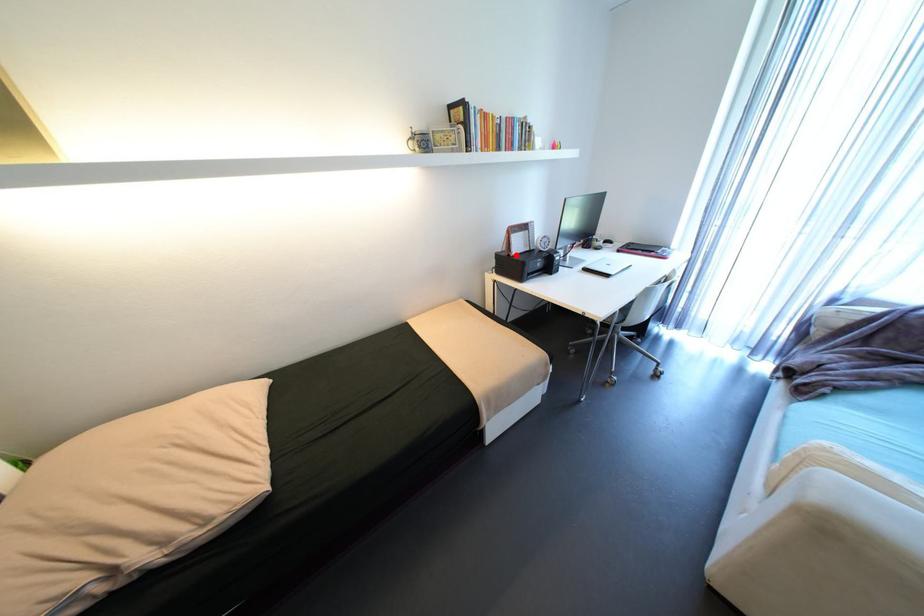
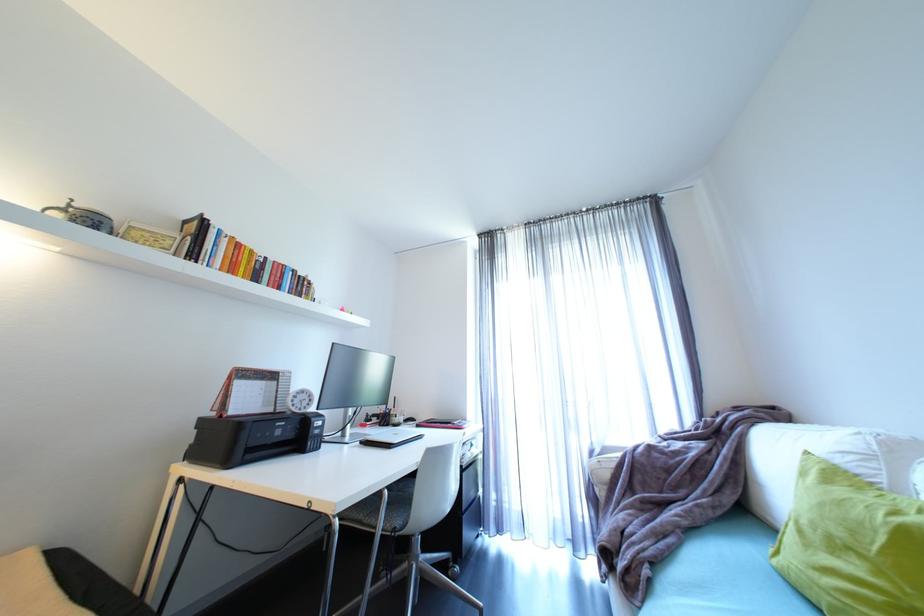
Question: I am providing you with two images of the same scene from different viewpoints. In image1, a red point is highlighted. Considering the same 3D point in image2, which of the following is correct?

Choices:
 (A) It is closer
 (B) It is farther

Answer: (B)